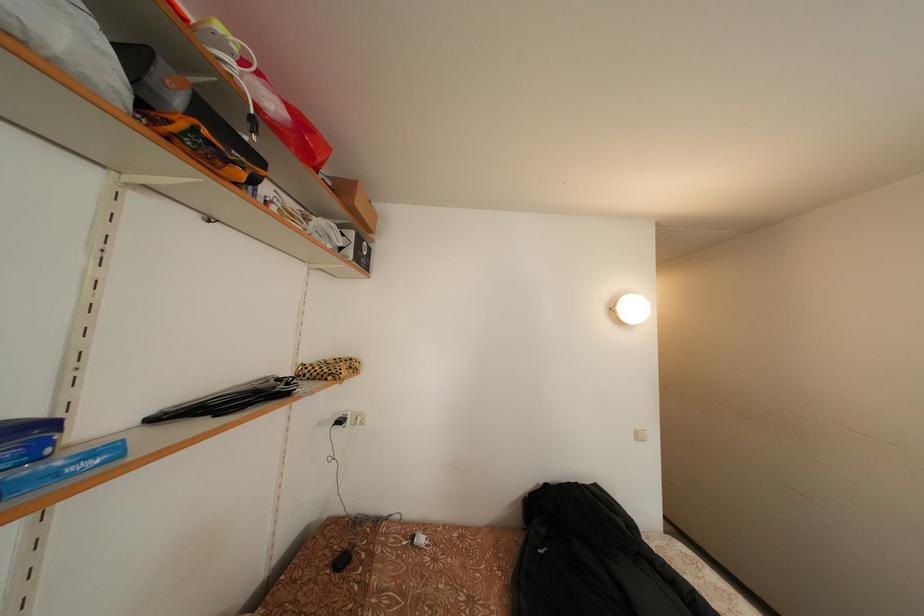
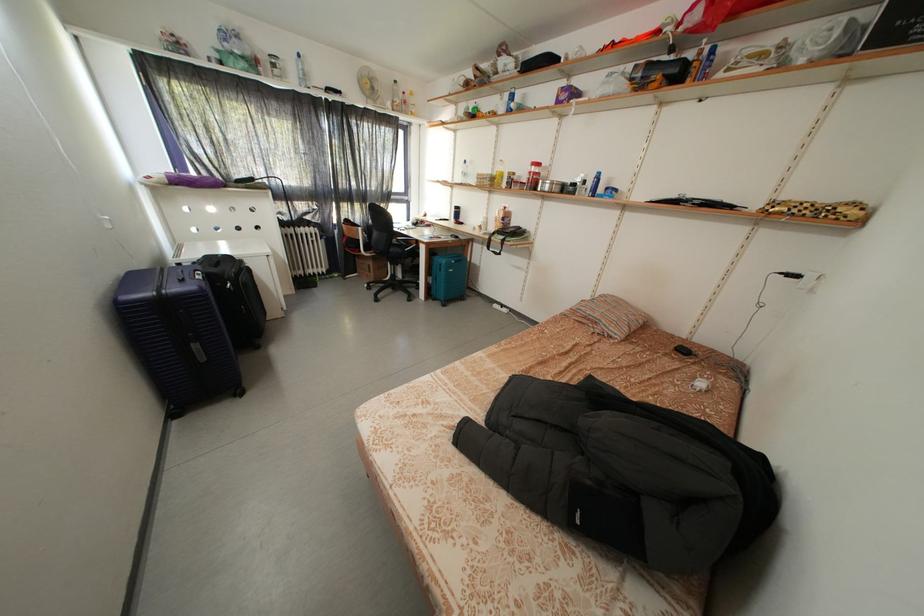
Locate, in the second image, the point that corresponds to point (350, 565) in the first image.

(691, 355)